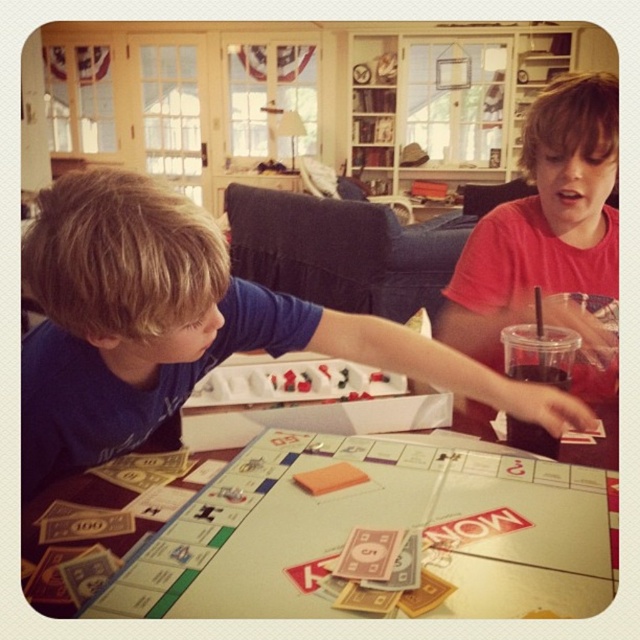
You are a game piece on the Monopoly board. You start at point (522, 225) and need to move towards point (198, 557). Which direction should you move?

You should move forward because point (198, 557) is in front of point (522, 225).

What are the coordinates of the white glossy monopoly board at center?

The white glossy monopoly board at center is located at coordinates point (376, 525).